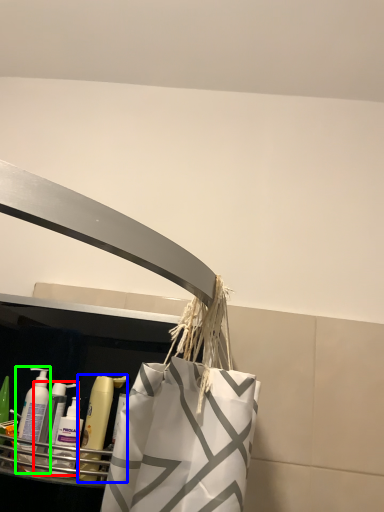
Question: Which is nearer to the cleaning product (highlighted by a red box)? mouthwash (highlighted by a blue box) or cleaning product (highlighted by a green box).

Choices:
 (A) mouthwash
 (B) cleaning product

Answer: (B)